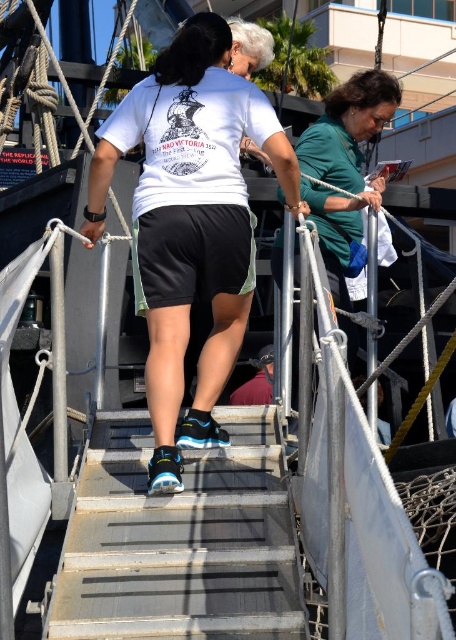
Question: Is the position of white matte t-shirt at center more distant than that of green matte shirt at upper right?

Choices:
 (A) no
 (B) yes

Answer: (A)

Question: Among these points, which one is farthest from the camera?

Choices:
 (A) (302, 186)
 (B) (211, 300)

Answer: (A)

Question: In this image, where is white matte t-shirt at center located relative to metallic gray stairs at center?

Choices:
 (A) right
 (B) left

Answer: (B)

Question: Among these objects, which one is farthest from the camera?

Choices:
 (A) green matte shirt at upper right
 (B) metallic gray stairs at center
 (C) white matte t-shirt at center

Answer: (A)

Question: Where is white matte t-shirt at center located in relation to green matte shirt at upper right in the image?

Choices:
 (A) right
 (B) left

Answer: (B)

Question: Among these points, which one is farthest from the camera?

Choices:
 (A) (73, 616)
 (B) (337, 172)

Answer: (B)